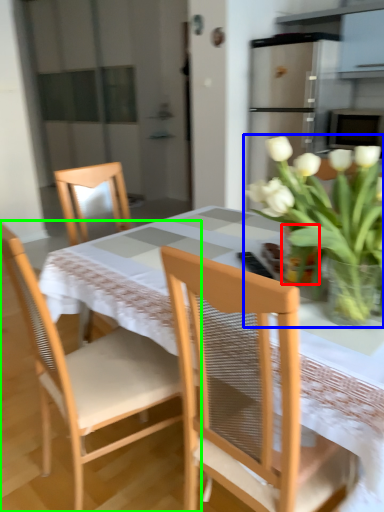
Question: Which object is positioned farthest from glass vase (highlighted by a red box)? Select from houseplant (highlighted by a blue box) and chair (highlighted by a green box).

Choices:
 (A) houseplant
 (B) chair

Answer: (B)